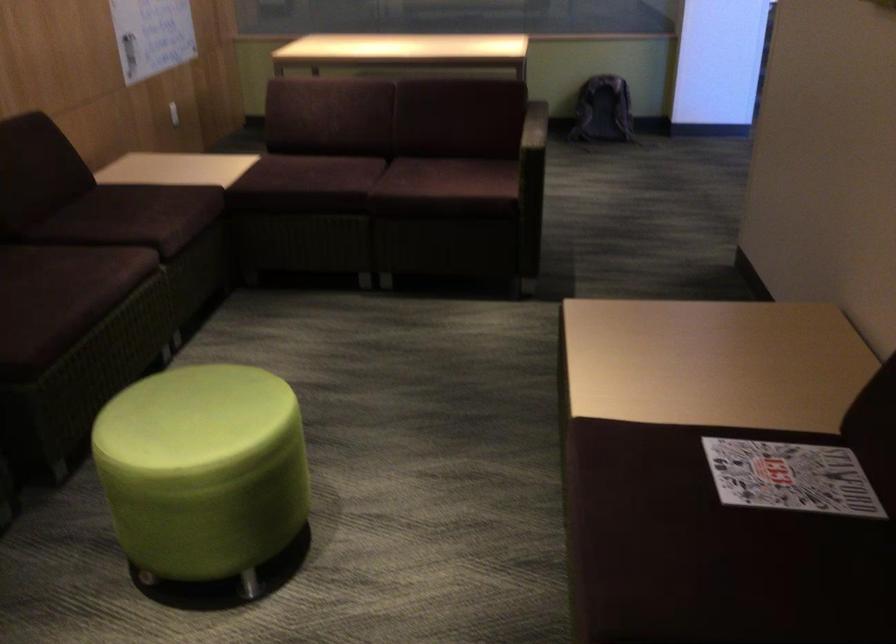
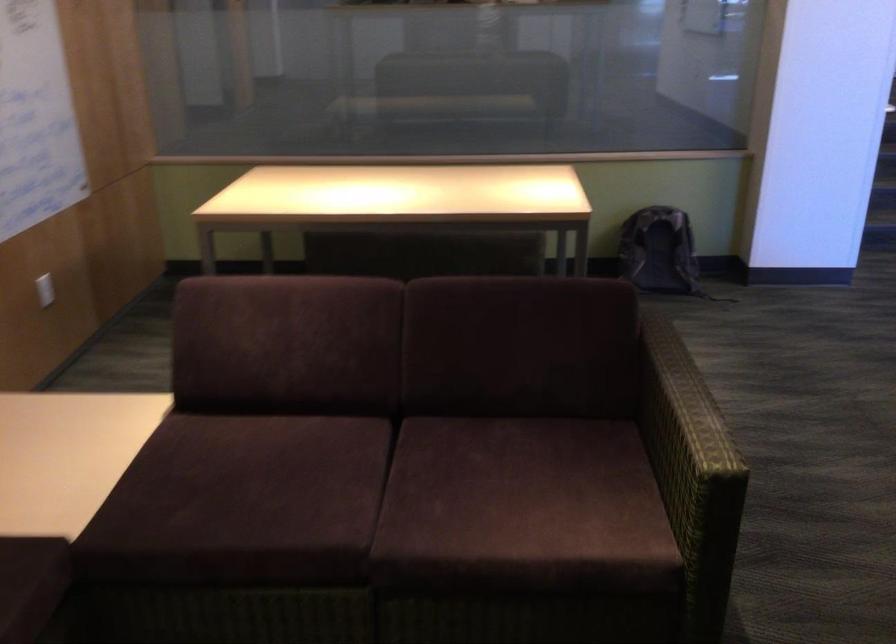
Where in the second image is the point corresponding to [536,124] from the first image?

(682, 404)